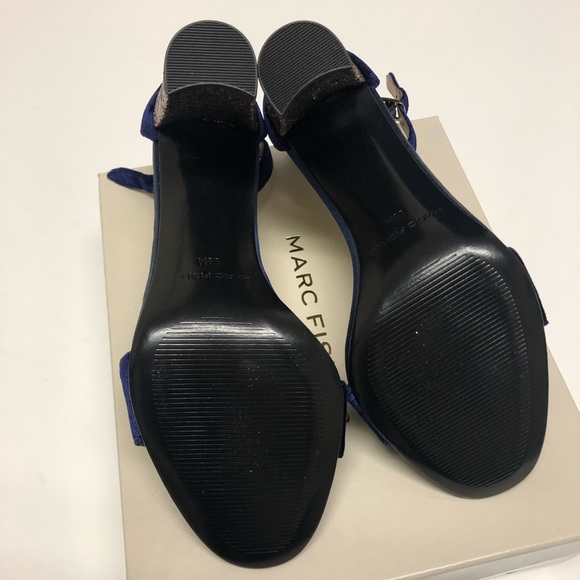
This screenshot has width=580, height=580. Identify the location of floor. (211, 229).